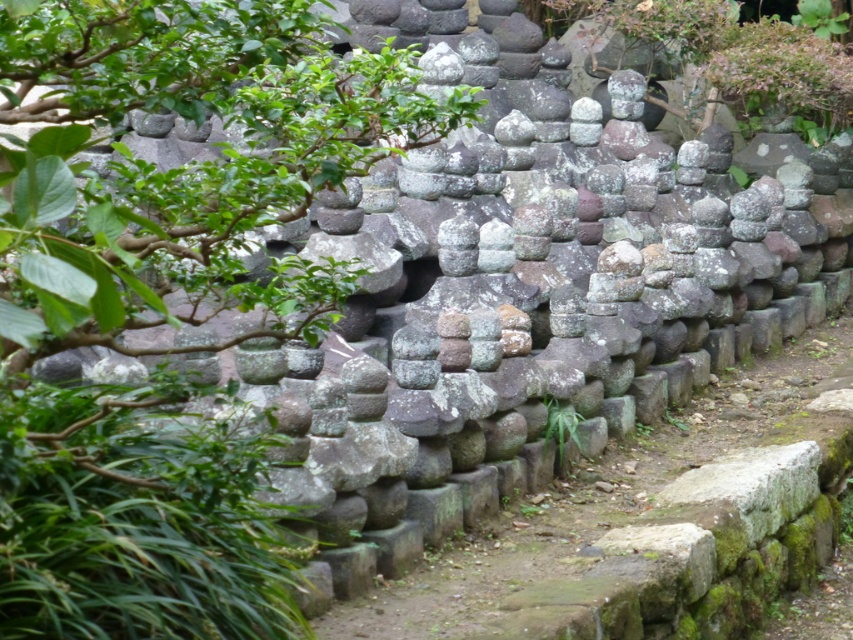
Question: Observing the image, what is the correct spatial positioning of green leafy tree at center in reference to mossy stone path at center?

Choices:
 (A) above
 (B) below

Answer: (A)

Question: Which object appears closest to the camera in this image?

Choices:
 (A) mossy stone path at center
 (B) green leafy tree at center

Answer: (B)

Question: Which of the following is the closest to the observer?

Choices:
 (A) (178, 35)
 (B) (473, 596)

Answer: (A)

Question: Can you confirm if green leafy tree at center is positioned to the left of mossy stone path at center?

Choices:
 (A) no
 (B) yes

Answer: (B)

Question: Does green leafy tree at center appear over mossy stone path at center?

Choices:
 (A) yes
 (B) no

Answer: (A)